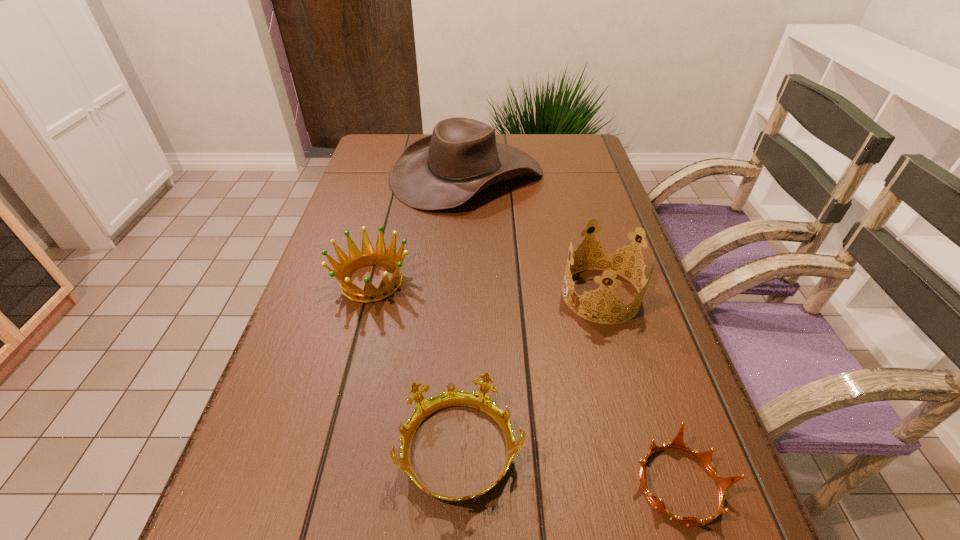
Where is `object that is the closest one to the tallest crown`? This screenshot has height=540, width=960. object that is the closest one to the tallest crown is located at coordinates (480, 400).

Select which crown appears as the third closest to the shortest object. Please provide its 2D coordinates. Your answer should be formatted as a tuple, i.e. [(x, y)], where the tuple contains the x and y coordinates of a point satisfying the conditions above.

[(356, 260)]

The height and width of the screenshot is (540, 960). I want to click on crown that is the second closest one to the tallest crown, so click(723, 484).

Where is `vacant point that satisfies the following two spatial constraints: 1. on the front side of the shortest crown; 2. on the left side of the third crown from right to left`? The width and height of the screenshot is (960, 540). vacant point that satisfies the following two spatial constraints: 1. on the front side of the shortest crown; 2. on the left side of the third crown from right to left is located at coordinates (460, 485).

I want to click on vacant area that satisfies the following two spatial constraints: 1. on the front side of the shortest object; 2. on the right side of the leftmost crown, so click(x=319, y=485).

In order to click on free space that satisfies the following two spatial constraints: 1. on the front side of the shortest object; 2. on the left side of the second crown from left to right in this screenshot , I will do `click(460, 485)`.

Identify the location of vacant region that satisfies the following two spatial constraints: 1. on the front side of the leftmost crown; 2. on the left side of the tallest crown. (368, 295).

I want to click on free space that satisfies the following two spatial constraints: 1. on the front side of the tallest crown; 2. on the left side of the shortest crown, so (655, 485).

At what (x,y) coordinates should I click in order to perform the action: click on free space that satisfies the following two spatial constraints: 1. on the front side of the leftmost crown; 2. on the left side of the shortest object. Please return your answer as a coordinate pair (x, y). This screenshot has width=960, height=540. Looking at the image, I should click on (319, 485).

Find the location of a particular element. The image size is (960, 540). free point that satisfies the following two spatial constraints: 1. on the front side of the shortest object; 2. on the left side of the third tallest crown is located at coordinates (460, 485).